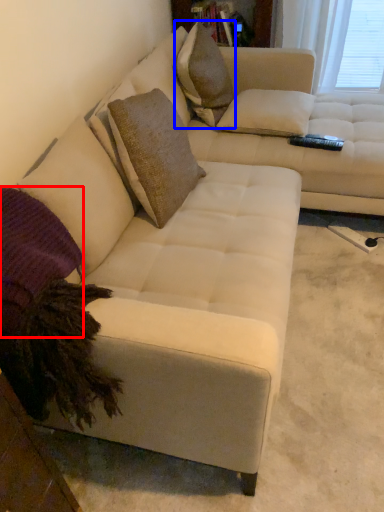
Question: Among these objects, which one is nearest to the camera, pillow (highlighted by a red box) or throw pillow (highlighted by a blue box)?

Choices:
 (A) pillow
 (B) throw pillow

Answer: (A)